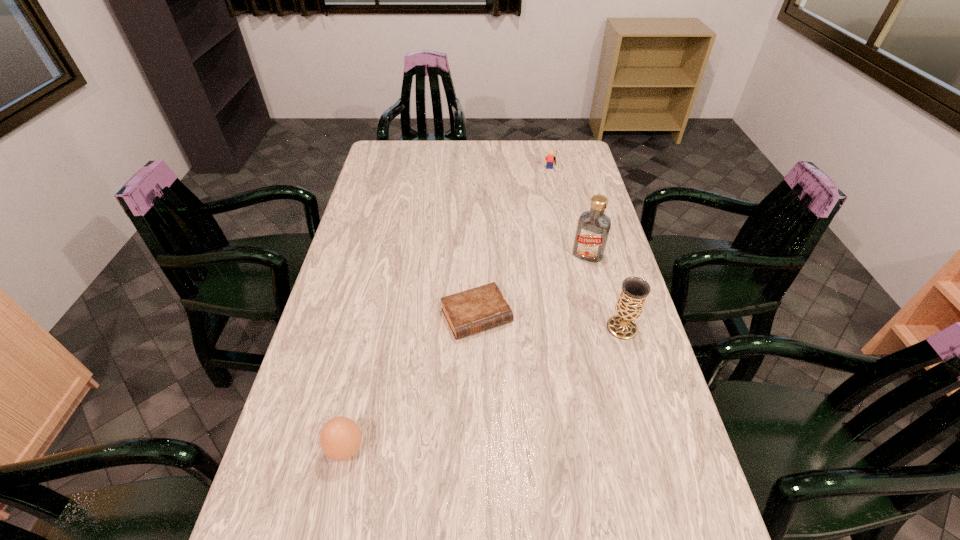
The width and height of the screenshot is (960, 540). I want to click on vacant space situated 0.230m on the spine side of the shortest object, so click(x=529, y=413).

Where is `free space located 0.310m on the spine side of the shortest object`? free space located 0.310m on the spine side of the shortest object is located at coordinates (545, 443).

At what (x,y) coordinates should I click in order to perform the action: click on free location located 0.340m on the spine side of the shortest object. Please return your answer as a coordinate pair (x, y). This screenshot has height=540, width=960. Looking at the image, I should click on (551, 455).

Locate an element on the screen. free space located on the front-facing side of the vodka is located at coordinates (576, 276).

Locate an element on the screen. This screenshot has width=960, height=540. free space located 0.110m on the front-facing side of the vodka is located at coordinates (572, 285).

Identify the location of vacant region located on the front-facing side of the vodka. (547, 336).

Where is `free space located on the front-facing side of the farthest object`? free space located on the front-facing side of the farthest object is located at coordinates (548, 189).

Find the location of a particular element. This screenshot has height=540, width=960. blank space located 0.210m on the front-facing side of the farthest object is located at coordinates coord(545,205).

Find the location of `free space located on the front-facing side of the farthest object`. free space located on the front-facing side of the farthest object is located at coordinates (546, 201).

The height and width of the screenshot is (540, 960). Identify the location of object that is at the far edge. tap(550, 158).